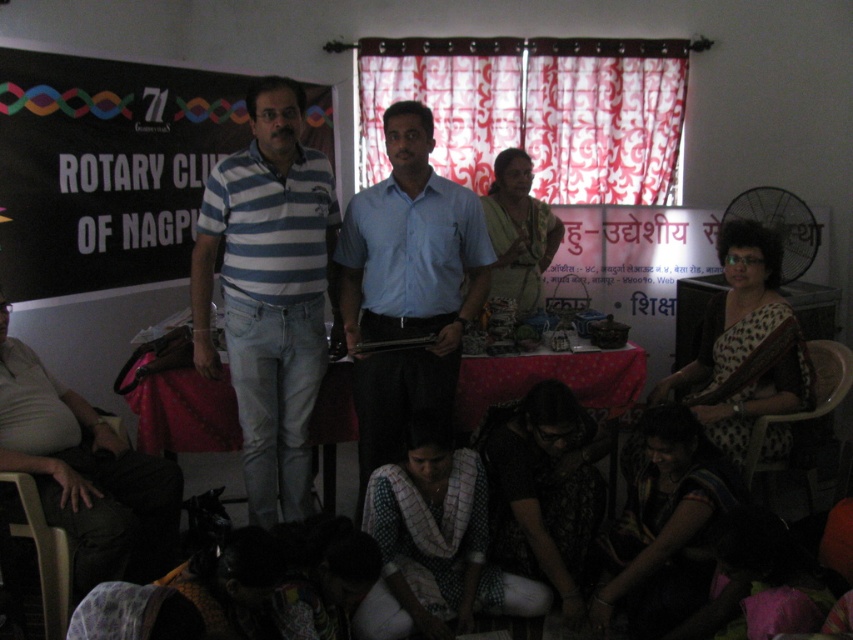
Is light blue shirt at center bigger than dark printed fabric at lower center?

Correct, light blue shirt at center is larger in size than dark printed fabric at lower center.

Consider the image. Is light blue shirt at center to the left of dark printed fabric at lower center from the viewer's perspective?

Indeed, light blue shirt at center is positioned on the left side of dark printed fabric at lower center.

This screenshot has width=853, height=640. I want to click on light blue shirt at center, so click(x=407, y=285).

Find the location of a particular element. The height and width of the screenshot is (640, 853). white dotted dress at right is located at coordinates (734, 308).

Can you confirm if white dotted dress at right is positioned above floral-patterned dress at center?

No, white dotted dress at right is not above floral-patterned dress at center.

This screenshot has width=853, height=640. Find the location of `white dotted dress at right`. white dotted dress at right is located at coordinates (734, 308).

What do you see at coordinates (105, 168) in the screenshot? I see `black fabric at upper left` at bounding box center [105, 168].

Which is above, black fabric at upper left or dark brown fabric saree at lower center?

black fabric at upper left

Describe the element at coordinates (105, 168) in the screenshot. I see `black fabric at upper left` at that location.

At what (x,y) coordinates should I click in order to perform the action: click on black fabric at upper left. Please return your answer as a coordinate pair (x, y). Looking at the image, I should click on (105, 168).